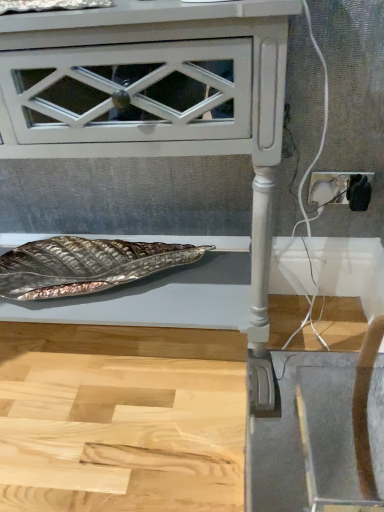
Question: Considering the relative sizes of white plastic socket at right and white glossy leaf tray at lower center in the image provided, is white plastic socket at right shorter than white glossy leaf tray at lower center?

Choices:
 (A) no
 (B) yes

Answer: (B)

Question: Is white plastic socket at right outside white glossy leaf tray at lower center?

Choices:
 (A) no
 (B) yes

Answer: (B)

Question: Is white plastic socket at right taller than white glossy leaf tray at lower center?

Choices:
 (A) no
 (B) yes

Answer: (A)

Question: Is the position of white plastic socket at right less distant than that of white glossy leaf tray at lower center?

Choices:
 (A) yes
 (B) no

Answer: (B)

Question: Is white plastic socket at right thinner than white glossy leaf tray at lower center?

Choices:
 (A) no
 (B) yes

Answer: (B)

Question: Is white plastic socket at right to the right of white glossy leaf tray at lower center from the viewer's perspective?

Choices:
 (A) yes
 (B) no

Answer: (A)

Question: Does white glossy leaf tray at lower center touch white plastic socket at right?

Choices:
 (A) yes
 (B) no

Answer: (B)

Question: Is white glossy leaf tray at lower center oriented towards white plastic socket at right?

Choices:
 (A) no
 (B) yes

Answer: (A)

Question: From the image's perspective, is white glossy leaf tray at lower center below white plastic socket at right?

Choices:
 (A) no
 (B) yes

Answer: (B)

Question: Can you confirm if white glossy leaf tray at lower center is thinner than white plastic socket at right?

Choices:
 (A) yes
 (B) no

Answer: (B)

Question: Is white glossy leaf tray at lower center behind white plastic socket at right?

Choices:
 (A) no
 (B) yes

Answer: (A)

Question: Can you confirm if white glossy leaf tray at lower center is bigger than white plastic socket at right?

Choices:
 (A) yes
 (B) no

Answer: (A)

Question: Considering the relative positions of white plastic socket at right and white glossy leaf tray at lower center in the image provided, is white plastic socket at right to the left or to the right of white glossy leaf tray at lower center?

Choices:
 (A) left
 (B) right

Answer: (B)